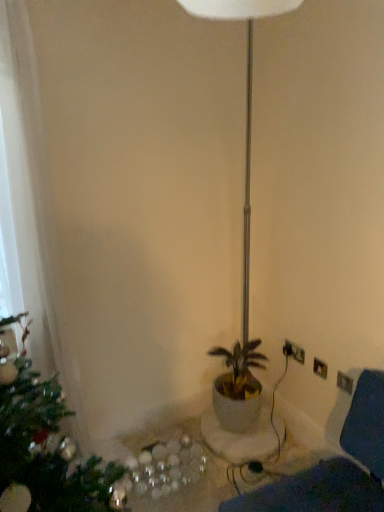
Question: From a real-world perspective, is white plastic electric outlet at lower right positioned under white fabric swivel chair at lower right based on gravity?

Choices:
 (A) yes
 (B) no

Answer: (B)

Question: Considering the relative positions of white plastic electric outlet at lower right and white fabric swivel chair at lower right in the image provided, is white plastic electric outlet at lower right to the left of white fabric swivel chair at lower right from the viewer's perspective?

Choices:
 (A) yes
 (B) no

Answer: (B)

Question: Is white plastic electric outlet at lower right outside white fabric swivel chair at lower right?

Choices:
 (A) no
 (B) yes

Answer: (B)

Question: Is white plastic electric outlet at lower right at the right side of white fabric swivel chair at lower right?

Choices:
 (A) no
 (B) yes

Answer: (B)

Question: Are white plastic electric outlet at lower right and white fabric swivel chair at lower right far apart?

Choices:
 (A) no
 (B) yes

Answer: (A)

Question: Does white plastic electric outlet at lower right come in front of white fabric swivel chair at lower right?

Choices:
 (A) no
 (B) yes

Answer: (A)

Question: Considering the relative sizes of white glossy table at lower center and white fabric swivel chair at lower right in the image provided, is white glossy table at lower center taller than white fabric swivel chair at lower right?

Choices:
 (A) no
 (B) yes

Answer: (A)

Question: Is white glossy table at lower center behind white fabric swivel chair at lower right?

Choices:
 (A) no
 (B) yes

Answer: (B)

Question: Can you confirm if white glossy table at lower center is shorter than white fabric swivel chair at lower right?

Choices:
 (A) yes
 (B) no

Answer: (A)

Question: Does white glossy table at lower center appear on the right side of white fabric swivel chair at lower right?

Choices:
 (A) yes
 (B) no

Answer: (B)

Question: From a real-world perspective, is white glossy table at lower center positioned over white fabric swivel chair at lower right based on gravity?

Choices:
 (A) yes
 (B) no

Answer: (B)

Question: Is white glossy table at lower center oriented away from white fabric swivel chair at lower right?

Choices:
 (A) no
 (B) yes

Answer: (A)

Question: Is white fabric swivel chair at lower right closer to camera compared to white glossy table at lower center?

Choices:
 (A) no
 (B) yes

Answer: (B)